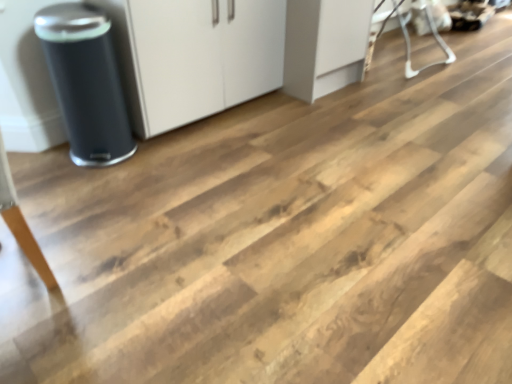
Question: Can you confirm if matte black trash can at left is wider than white plastic baby bouncer at upper right?

Choices:
 (A) no
 (B) yes

Answer: (A)

Question: Is white plastic baby bouncer at upper right surrounded by matte black trash can at left?

Choices:
 (A) no
 (B) yes

Answer: (A)

Question: Could you tell me if matte black trash can at left is facing white plastic baby bouncer at upper right?

Choices:
 (A) no
 (B) yes

Answer: (A)

Question: Does matte black trash can at left have a greater height compared to white plastic baby bouncer at upper right?

Choices:
 (A) yes
 (B) no

Answer: (A)

Question: From the image's perspective, is matte black trash can at left over white plastic baby bouncer at upper right?

Choices:
 (A) yes
 (B) no

Answer: (B)

Question: In terms of width, does white plastic baby bouncer at upper right look wider or thinner when compared to white matte cabinet at center?

Choices:
 (A) wide
 (B) thin

Answer: (A)

Question: In terms of height, does white plastic baby bouncer at upper right look taller or shorter compared to white matte cabinet at center?

Choices:
 (A) tall
 (B) short

Answer: (B)

Question: From a real-world perspective, is white plastic baby bouncer at upper right physically located above or below white matte cabinet at center?

Choices:
 (A) above
 (B) below

Answer: (B)

Question: From the image's perspective, relative to white matte cabinet at center, is white plastic baby bouncer at upper right above or below?

Choices:
 (A) below
 (B) above

Answer: (B)

Question: Does point (226, 79) appear closer or farther from the camera than point (401, 29)?

Choices:
 (A) closer
 (B) farther

Answer: (A)

Question: Would you say white matte cabinet at center is to the left or to the right of white plastic baby bouncer at upper right in the picture?

Choices:
 (A) right
 (B) left

Answer: (B)

Question: Choose the correct answer: Is white matte cabinet at center inside white plastic baby bouncer at upper right or outside it?

Choices:
 (A) inside
 (B) outside

Answer: (B)

Question: Considering the positions of white matte cabinet at center and white plastic baby bouncer at upper right in the image, is white matte cabinet at center bigger or smaller than white plastic baby bouncer at upper right?

Choices:
 (A) big
 (B) small

Answer: (A)

Question: In terms of height, does white plastic baby bouncer at upper right look taller or shorter compared to matte black trash can at left?

Choices:
 (A) short
 (B) tall

Answer: (A)

Question: Does point (410, 64) appear closer or farther from the camera than point (114, 117)?

Choices:
 (A) closer
 (B) farther

Answer: (B)